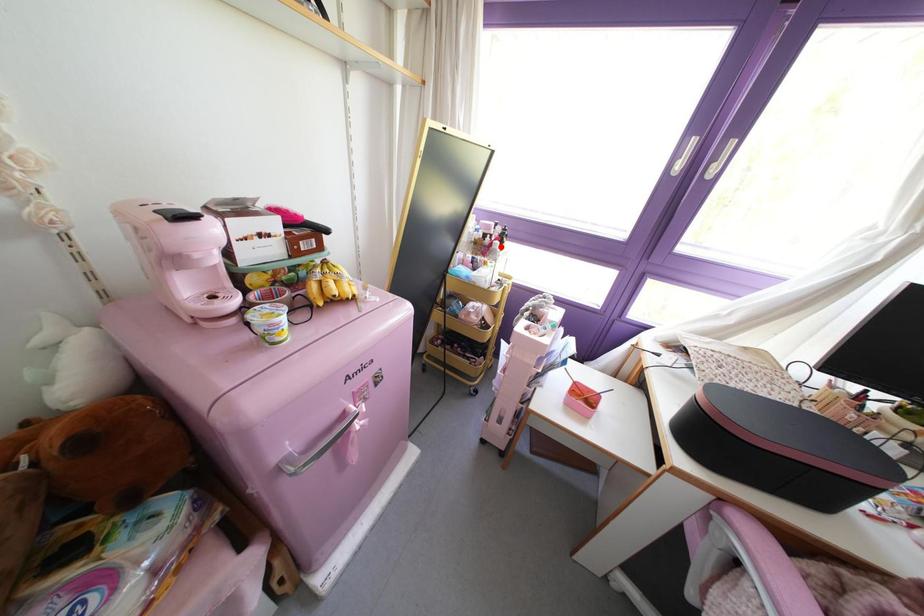
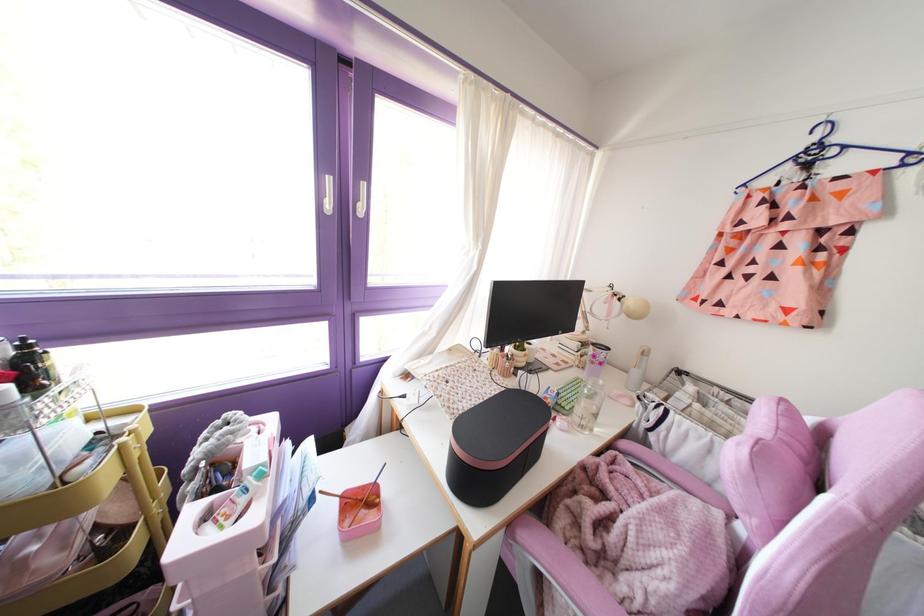
Find the pixel in the second image that matches the highlighted location in the first image.

(32, 389)